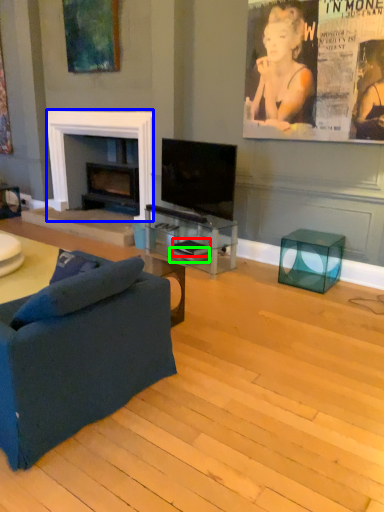
Question: Considering the real-world distances, which object is closest to magazine (highlighted by a red box)? fireplace (highlighted by a blue box) or magazine (highlighted by a green box).

Choices:
 (A) fireplace
 (B) magazine

Answer: (B)